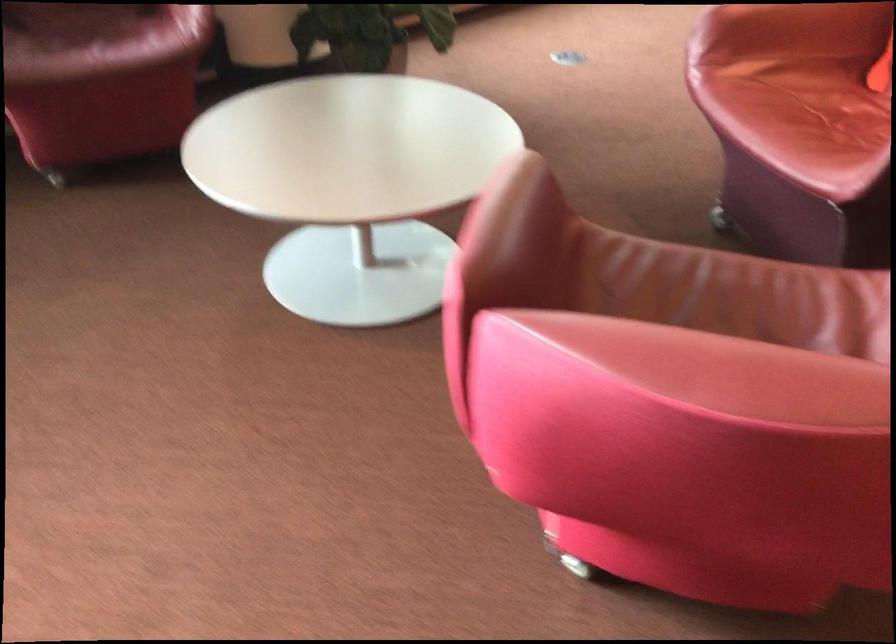
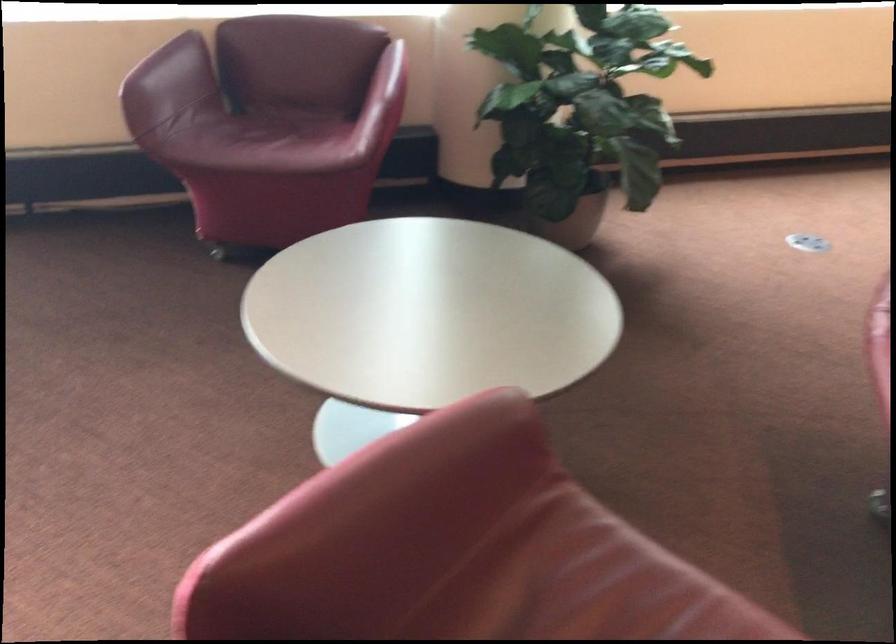
Question: The camera is either moving clockwise (left) or counter-clockwise (right) around the object. The first image is from the beginning of the video and the second image is from the end. Is the camera moving left or right when shooting the video?

Choices:
 (A) Left
 (B) Right

Answer: (B)